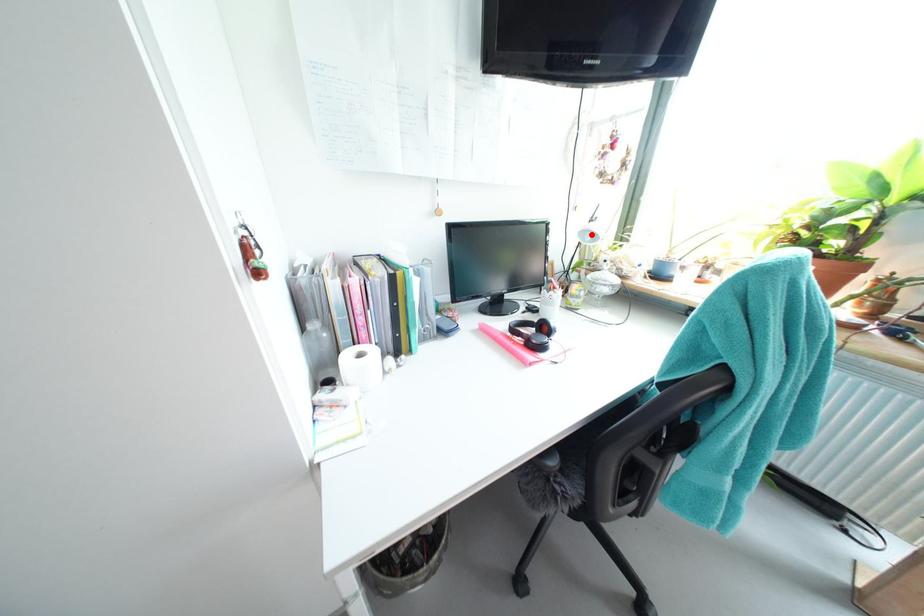
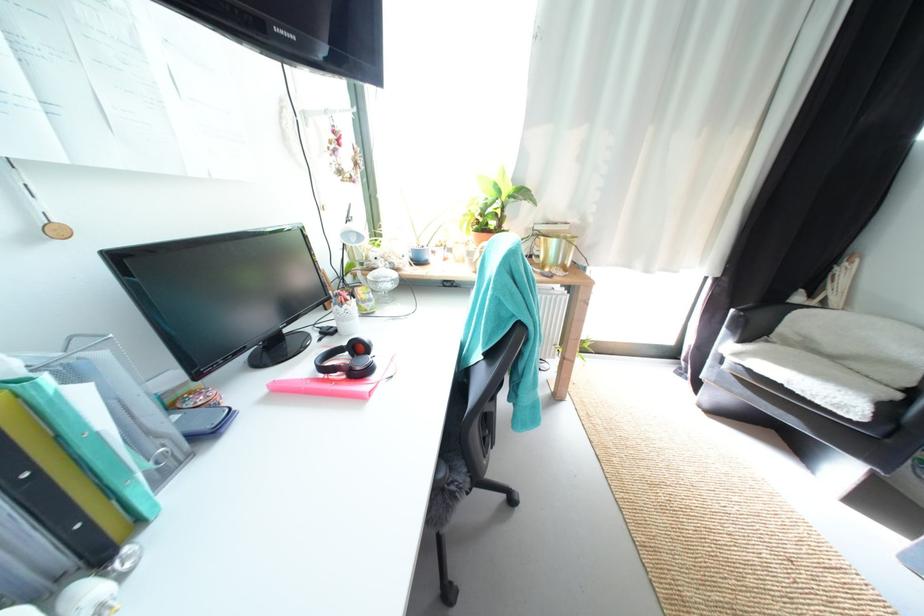
In the second image, find the point that corresponds to the highlighted location in the first image.

(354, 236)